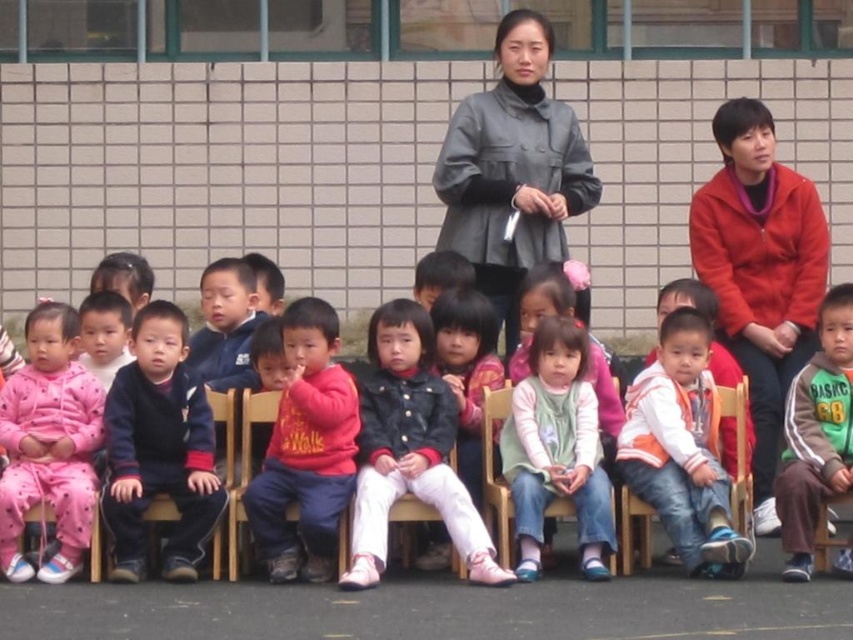
Can you confirm if matte gray coat at center is smaller than wooden chair at lower right?

No, matte gray coat at center is not smaller than wooden chair at lower right.

Does matte gray coat at center have a greater width compared to wooden chair at lower right?

Yes, matte gray coat at center is wider than wooden chair at lower right.

The width and height of the screenshot is (853, 640). I want to click on matte gray coat at center, so click(512, 170).

Where is `matte gray coat at center`? Image resolution: width=853 pixels, height=640 pixels. matte gray coat at center is located at coordinates (512, 170).

Is the position of green fleece jacket at lower right less distant than that of dark blue denim jacket at center?

Yes, green fleece jacket at lower right is closer to the viewer.

The width and height of the screenshot is (853, 640). Describe the element at coordinates (816, 433) in the screenshot. I see `green fleece jacket at lower right` at that location.

Locate an element on the screen. green fleece jacket at lower right is located at coordinates (816, 433).

Can you confirm if pink fleece pants at left is positioned above dark blue denim jacket at center?

No.

Who is positioned more to the right, pink fleece pants at left or dark blue denim jacket at center?

dark blue denim jacket at center

Which is in front, point (27, 353) or point (467, 344)?

Point (467, 344)

The image size is (853, 640). Identify the location of pink fleece pants at left. (49, 444).